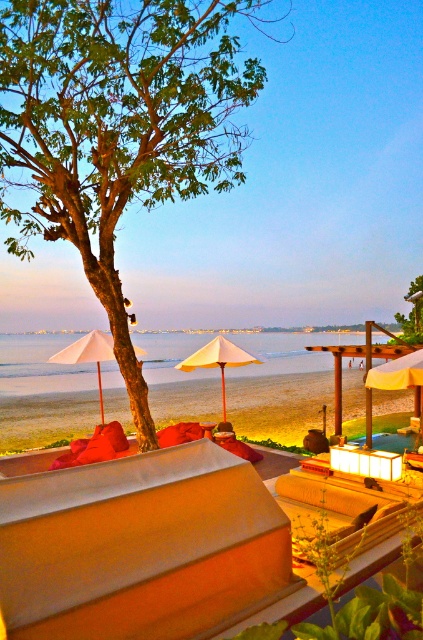
Does yellow fabric umbrella at center have a greater width compared to beige fabric umbrella at center?

Yes.

Is point (398, 362) positioned after point (192, 358)?

No, it is in front of (192, 358).

The image size is (423, 640). I want to click on yellow fabric umbrella at center, so click(400, 376).

Which is in front, point (315, 403) or point (90, 353)?

Positioned in front is point (90, 353).

Image resolution: width=423 pixels, height=640 pixels. In order to click on clear water at beach center in this screenshot , I will do `click(280, 387)`.

How far apart are yellow fabric umbrella at center and white matte umbrella at left?

A distance of 6.76 meters exists between yellow fabric umbrella at center and white matte umbrella at left.

Can you confirm if yellow fabric umbrella at center is positioned to the right of white matte umbrella at left?

Yes, yellow fabric umbrella at center is to the right of white matte umbrella at left.

Is point (420, 400) more distant than point (71, 353)?

Yes.

Identify the location of yellow fabric umbrella at center. point(400,376).